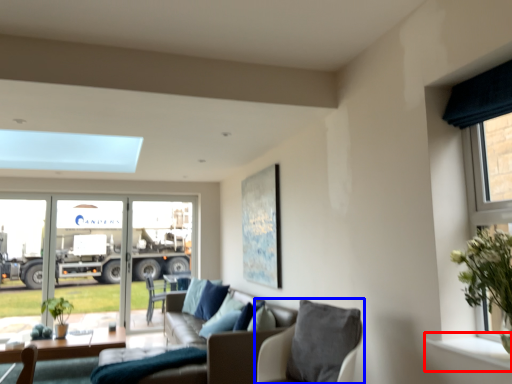
Question: Which point is closer to the camera, window sill (highlighted by a red box) or chair (highlighted by a blue box)?

Choices:
 (A) window sill
 (B) chair

Answer: (A)